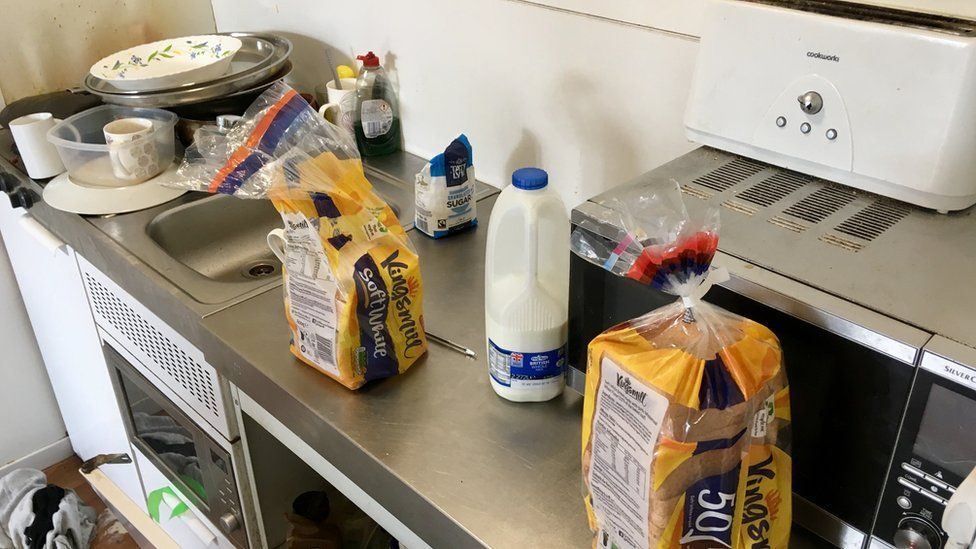
Locate an element on the screen. floor is located at coordinates (60, 460), (72, 481).